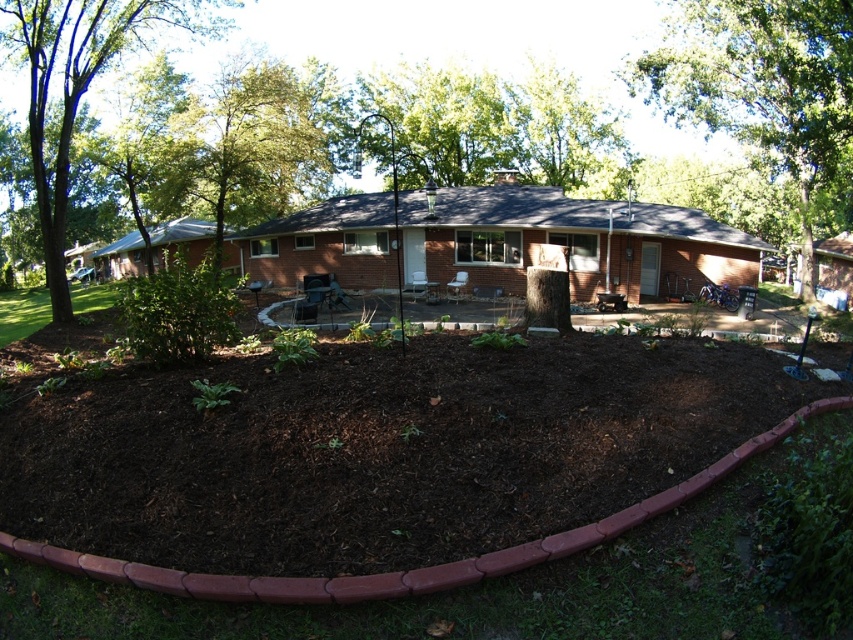
Identify the location of dark brown mulch at center. (376, 451).

Does dark brown mulch at center have a larger size compared to green leafy tree at upper left?

Actually, dark brown mulch at center might be smaller than green leafy tree at upper left.

What do you see at coordinates (376, 451) in the screenshot?
I see `dark brown mulch at center` at bounding box center [376, 451].

The image size is (853, 640). I want to click on dark brown mulch at center, so 376,451.

Does point (172, 484) come farther from viewer compared to point (839, 86)?

That is False.

Looking at this image, which of these two, dark brown mulch at center or green leafy tree at upper center, stands taller?

green leafy tree at upper center is taller.

The width and height of the screenshot is (853, 640). Describe the element at coordinates (376, 451) in the screenshot. I see `dark brown mulch at center` at that location.

This screenshot has width=853, height=640. Find the location of `dark brown mulch at center`. dark brown mulch at center is located at coordinates (376, 451).

Between green leafy tree at upper center and green leafy tree at upper left, which one is positioned lower?

green leafy tree at upper center is below.

Does point (685, 38) lie behind point (163, 8)?

Yes, it is behind point (163, 8).

Where is `green leafy tree at upper center`? Image resolution: width=853 pixels, height=640 pixels. green leafy tree at upper center is located at coordinates (764, 90).